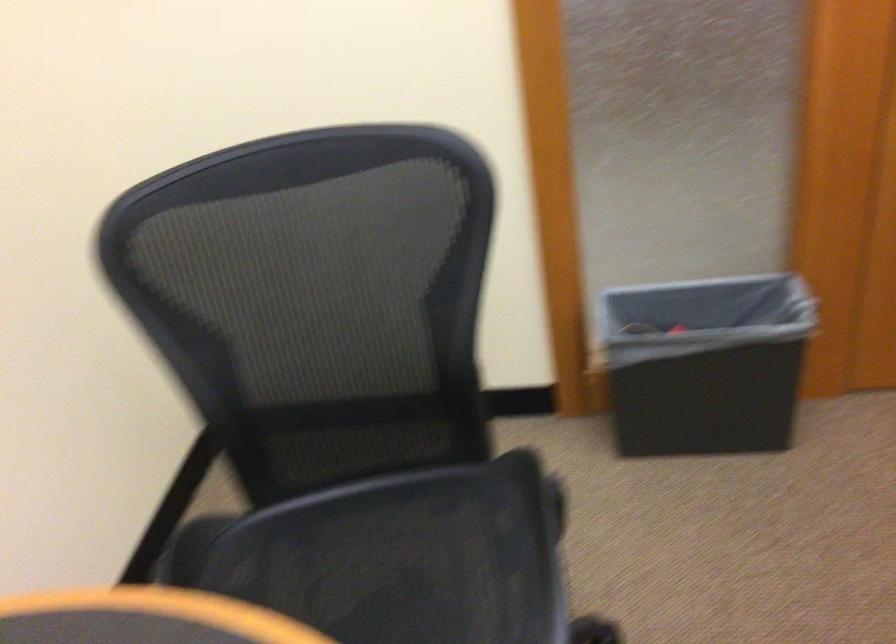
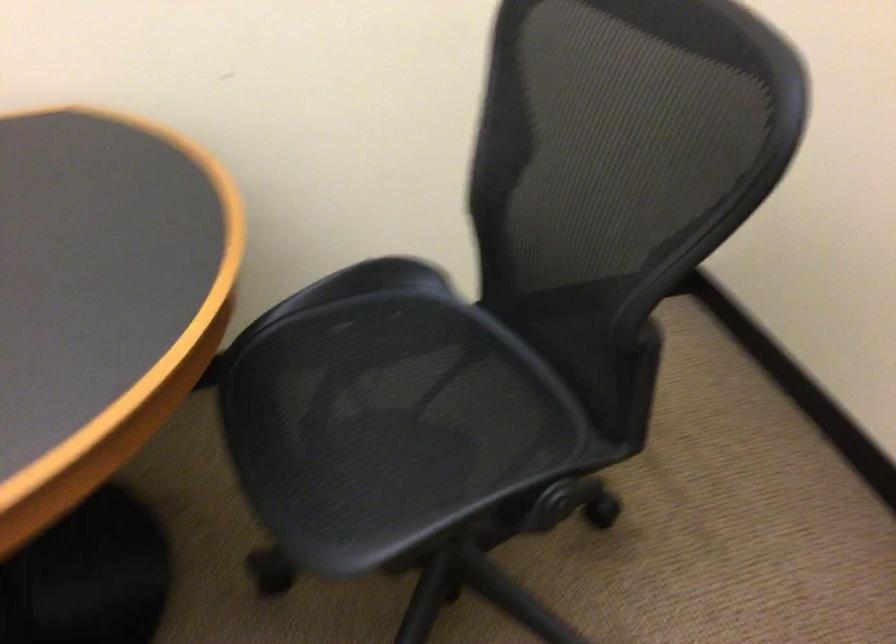
First-person continuous shooting, in which direction is the camera rotating?

The camera's rotation is toward left-down.